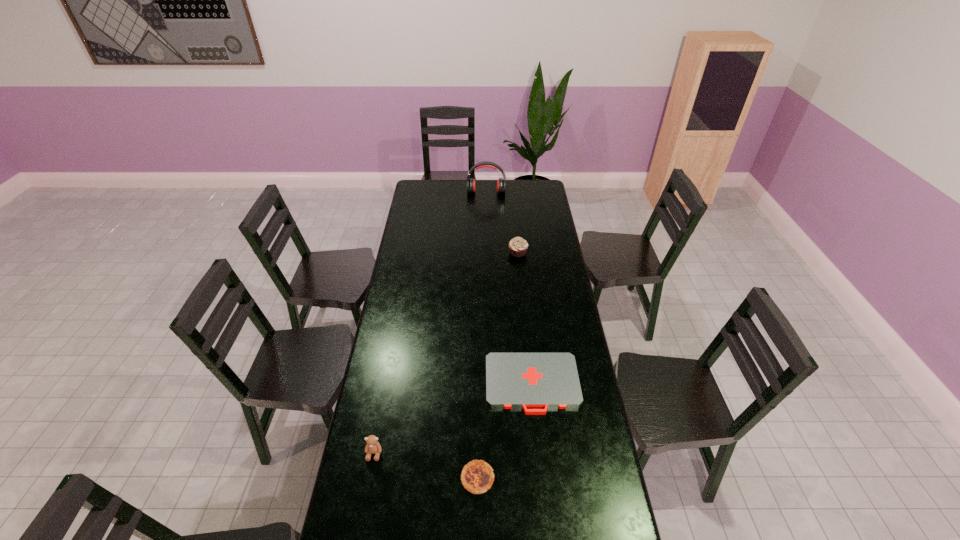
Select which object is the closest to the second shortest object. Please provide its 2D coordinates. Your answer should be formatted as a tuple, i.e. [(x, y)], where the tuple contains the x and y coordinates of a point satisfying the conditions above.

[(523, 380)]

Find the location of a particular element. the closest object to the teddy bear is located at coordinates (477, 476).

Locate an element on the screen. The image size is (960, 540). free space in the image that satisfies the following two spatial constraints: 1. on the front-facing side of the fourth farthest object; 2. on the right side of the quiche is located at coordinates tap(370, 478).

I want to click on free space that satisfies the following two spatial constraints: 1. on the ear cups of the farthest object; 2. on the left side of the muffin, so (x=488, y=252).